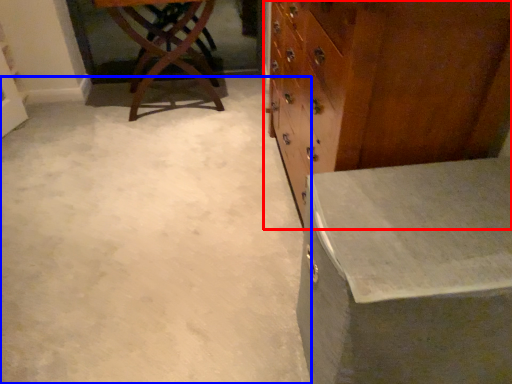
Question: Among these objects, which one is farthest to the camera, chest of drawers (highlighted by a red box) or concrete (highlighted by a blue box)?

Choices:
 (A) chest of drawers
 (B) concrete

Answer: (B)